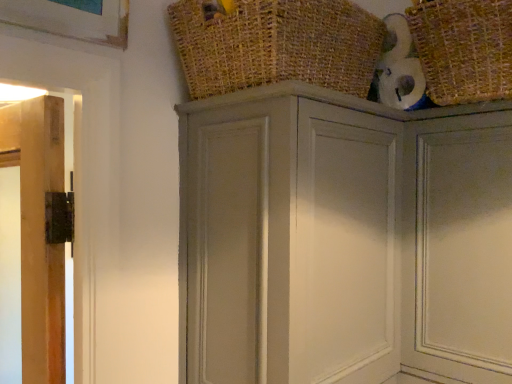
Question: Which direction should I rotate to face burlap basket at upper center, placed as the first basket when sorted from left to right, — up or down?

Choices:
 (A) up
 (B) down

Answer: (A)

Question: Can you confirm if burlap basket at upper center, the second basket viewed from the right, is taller than matte gray cupboard at upper center?

Choices:
 (A) yes
 (B) no

Answer: (B)

Question: From the image's perspective, is burlap basket at upper center, the second basket viewed from the right, above matte gray cupboard at upper center?

Choices:
 (A) yes
 (B) no

Answer: (A)

Question: From a real-world perspective, is burlap basket at upper center, placed as the first basket when sorted from left to right, positioned over matte gray cupboard at upper center based on gravity?

Choices:
 (A) no
 (B) yes

Answer: (B)

Question: From the image's perspective, does burlap basket at upper center, the second basket viewed from the right, appear lower than matte gray cupboard at upper center?

Choices:
 (A) no
 (B) yes

Answer: (A)

Question: Is burlap basket at upper center, the second basket viewed from the right, bigger than matte gray cupboard at upper center?

Choices:
 (A) no
 (B) yes

Answer: (A)

Question: Is burlap basket at upper center, placed as the first basket when sorted from left to right, outside of matte gray cupboard at upper center?

Choices:
 (A) no
 (B) yes

Answer: (B)

Question: Considering the relative positions of matte gray cupboard at upper center and burlap basket at upper center, placed as the first basket when sorted from left to right, in the image provided, is matte gray cupboard at upper center in front of burlap basket at upper center, placed as the first basket when sorted from left to right,?

Choices:
 (A) yes
 (B) no

Answer: (B)

Question: Does matte gray cupboard at upper center turn towards burlap basket at upper center, the second basket viewed from the right?

Choices:
 (A) no
 (B) yes

Answer: (A)

Question: From a real-world perspective, is matte gray cupboard at upper center over burlap basket at upper center, placed as the first basket when sorted from left to right?

Choices:
 (A) yes
 (B) no

Answer: (B)

Question: Can you confirm if matte gray cupboard at upper center is wider than burlap basket at upper center, the second basket viewed from the right?

Choices:
 (A) no
 (B) yes

Answer: (B)

Question: Does matte gray cupboard at upper center have a smaller size compared to burlap basket at upper center, the second basket viewed from the right?

Choices:
 (A) yes
 (B) no

Answer: (B)

Question: From the image's perspective, is matte gray cupboard at upper center over burlap basket at upper center, the second basket viewed from the right?

Choices:
 (A) no
 (B) yes

Answer: (A)

Question: Is matte gray door at upper right not inside burlap basket at upper center, the second basket viewed from the right?

Choices:
 (A) no
 (B) yes

Answer: (B)